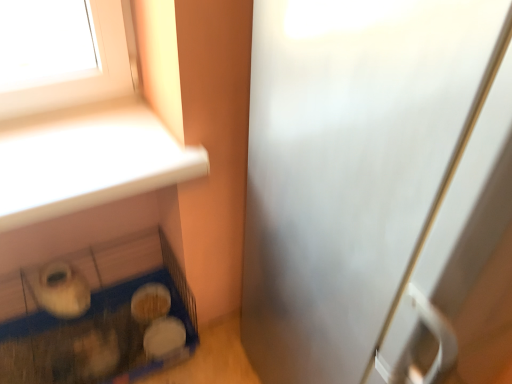
Question: Does satin silver screen door at right appear on the left side of blue plastic bird cage at lower left?

Choices:
 (A) no
 (B) yes

Answer: (A)

Question: Does satin silver screen door at right have a lesser width compared to blue plastic bird cage at lower left?

Choices:
 (A) no
 (B) yes

Answer: (A)

Question: Does satin silver screen door at right have a smaller size compared to blue plastic bird cage at lower left?

Choices:
 (A) no
 (B) yes

Answer: (A)

Question: Is satin silver screen door at right shorter than blue plastic bird cage at lower left?

Choices:
 (A) no
 (B) yes

Answer: (A)

Question: Would you say satin silver screen door at right is a long distance from blue plastic bird cage at lower left?

Choices:
 (A) yes
 (B) no

Answer: (B)

Question: From the image's perspective, relative to white matte food at lower left, which is the second food from bottom to top, is satin silver screen door at right above or below?

Choices:
 (A) above
 (B) below

Answer: (A)

Question: Do you think satin silver screen door at right is within white matte food at lower left, which is counted as the 1th food, starting from the top, or outside of it?

Choices:
 (A) outside
 (B) inside

Answer: (A)

Question: Considering the positions of satin silver screen door at right and white matte food at lower left, which is counted as the 1th food, starting from the top, in the image, is satin silver screen door at right bigger or smaller than white matte food at lower left, which is counted as the 1th food, starting from the top,?

Choices:
 (A) small
 (B) big

Answer: (B)

Question: Considering their positions, is satin silver screen door at right located in front of or behind white matte food at lower left, which is the second food from bottom to top?

Choices:
 (A) behind
 (B) front

Answer: (B)

Question: From their relative heights in the image, would you say white matte food at lower left, which is counted as the 1th food, starting from the top, is taller or shorter than white matte bowl at lower center, which is the second food from top to bottom?

Choices:
 (A) short
 (B) tall

Answer: (B)

Question: From a real-world perspective, is white matte food at lower left, which is the second food from bottom to top, above or below white matte bowl at lower center, arranged as the 1th food when ordered from the bottom?

Choices:
 (A) below
 (B) above

Answer: (B)

Question: Is white matte food at lower left, which is the second food from bottom to top, spatially inside white matte bowl at lower center, which is the second food from top to bottom, or outside of it?

Choices:
 (A) inside
 (B) outside

Answer: (B)

Question: In terms of width, does white matte food at lower left, which is counted as the 1th food, starting from the top, look wider or thinner when compared to white matte bowl at lower center, which is the second food from top to bottom?

Choices:
 (A) thin
 (B) wide

Answer: (B)

Question: Considering their positions, is white matte bowl at lower center, arranged as the 1th food when ordered from the bottom, located in front of or behind satin silver screen door at right?

Choices:
 (A) front
 (B) behind

Answer: (B)

Question: From a real-world perspective, is white matte bowl at lower center, arranged as the 1th food when ordered from the bottom, physically located above or below satin silver screen door at right?

Choices:
 (A) below
 (B) above

Answer: (A)